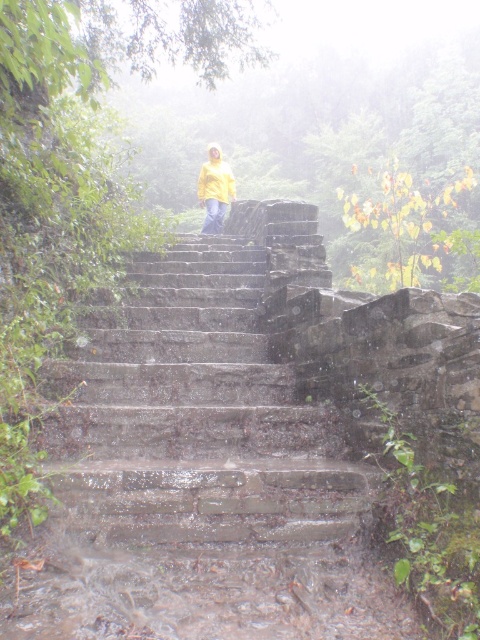
Identify the location of wet stone stairs at center. (194, 416).

Which is more to the left, wet stone stairs at center or yellow matte jacket at center?

yellow matte jacket at center is more to the left.

I want to click on wet stone stairs at center, so click(x=194, y=416).